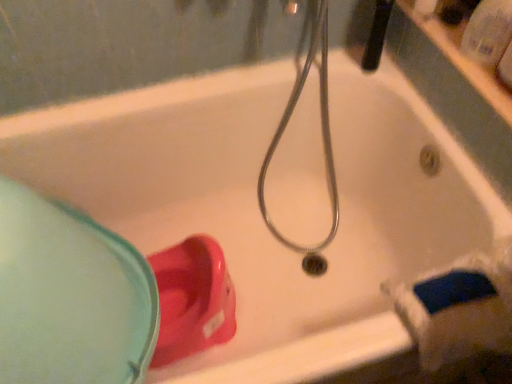
Describe the element at coordinates (376, 36) in the screenshot. I see `black rubber showerhead at upper center` at that location.

What is the approximate width of transparent plastic bottle at upper right?

It is 1.85 inches.

From the picture: Measure the distance between point (473,11) and camera.

The depth of point (473,11) is 83.50 centimeters.

You are a GUI agent. You are given a task and a screenshot of the screen. Output one action in this format:
    pyautogui.click(x=<x>, y=<y>)
    Task: Click on the matte plastic cup at lower left
    The width and height of the screenshot is (512, 384).
    Given the screenshot: What is the action you would take?
    pyautogui.click(x=97, y=297)

Who is bigger, black rubber showerhead at upper center or transparent plastic bottle at upper right?

Bigger between the two is black rubber showerhead at upper center.

Consider the image. Considering the sizes of black rubber showerhead at upper center and transparent plastic bottle at upper right in the image, is black rubber showerhead at upper center wider or thinner than transparent plastic bottle at upper right?

Considering their sizes, black rubber showerhead at upper center looks broader than transparent plastic bottle at upper right.

Is black rubber showerhead at upper center aimed at transparent plastic bottle at upper right?

No, black rubber showerhead at upper center is not oriented towards transparent plastic bottle at upper right.

Are black rubber showerhead at upper center and transparent plastic bottle at upper right making contact?

black rubber showerhead at upper center and transparent plastic bottle at upper right are not in contact.

Considering their positions, is matte plastic cup at lower left located in front of or behind black rubber showerhead at upper center?

Clearly, matte plastic cup at lower left is in front of black rubber showerhead at upper center.

Looking at this image, how many degrees apart are the facing directions of matte plastic cup at lower left and black rubber showerhead at upper center?

The facing directions of matte plastic cup at lower left and black rubber showerhead at upper center are 79.9 degrees apart.

Is matte plastic cup at lower left outside of black rubber showerhead at upper center?

That's correct, matte plastic cup at lower left is outside of black rubber showerhead at upper center.

Based on the photo, is matte plastic cup at lower left far away from black rubber showerhead at upper center?

That's not correct — matte plastic cup at lower left is a little close to black rubber showerhead at upper center.

Can you confirm if matte plastic cup at lower left is bigger than transparent plastic bottle at upper right?

Indeed, matte plastic cup at lower left has a larger size compared to transparent plastic bottle at upper right.

Between matte plastic cup at lower left and transparent plastic bottle at upper right, which one is positioned behind?

transparent plastic bottle at upper right.

Is matte plastic cup at lower left wider than transparent plastic bottle at upper right?

Yes, matte plastic cup at lower left is wider than transparent plastic bottle at upper right.

Is matte plastic cup at lower left facing towards transparent plastic bottle at upper right?

No.

Which point is more forward, (373, 50) or (106, 240)?

The point (106, 240) is in front.

Who is shorter, black rubber showerhead at upper center or matte plastic cup at lower left?

black rubber showerhead at upper center is shorter.

Is black rubber showerhead at upper center not near matte plastic cup at lower left?

No, black rubber showerhead at upper center is not far from matte plastic cup at lower left.

Identify the location of sink located in front of the transparent plastic bottle at upper right. (97, 297).

Between transparent plastic bottle at upper right and matte plastic cup at lower left, which one has larger width?

With larger width is matte plastic cup at lower left.

Based on their sizes in the image, would you say transparent plastic bottle at upper right is bigger or smaller than matte plastic cup at lower left?

Considering their sizes, transparent plastic bottle at upper right takes up less space than matte plastic cup at lower left.

Is transparent plastic bottle at upper right looking in the opposite direction of matte plastic cup at lower left?

No, transparent plastic bottle at upper right is not facing the opposite direction of matte plastic cup at lower left.

What's the angular difference between transparent plastic bottle at upper right and black rubber showerhead at upper center's facing directions?

The angular difference between transparent plastic bottle at upper right and black rubber showerhead at upper center is 21.6 degrees.

Looking at this image, from a real-world perspective, who is located lower, transparent plastic bottle at upper right or black rubber showerhead at upper center?

From a 3D spatial view, black rubber showerhead at upper center is below.

Is transparent plastic bottle at upper right spatially inside black rubber showerhead at upper center, or outside of it?

transparent plastic bottle at upper right lies outside black rubber showerhead at upper center.

Can you confirm if transparent plastic bottle at upper right is positioned to the left of black rubber showerhead at upper center?

Incorrect, transparent plastic bottle at upper right is not on the left side of black rubber showerhead at upper center.

Identify the location of toiletry on the right of black rubber showerhead at upper center. (490, 35).

Where is `sink lying on the left of black rubber showerhead at upper center`? Image resolution: width=512 pixels, height=384 pixels. sink lying on the left of black rubber showerhead at upper center is located at coordinates (97, 297).

When comparing their distances from matte plastic cup at lower left, does transparent plastic bottle at upper right or black rubber showerhead at upper center seem closer?

black rubber showerhead at upper center is positioned closer to the anchor matte plastic cup at lower left.

Based on their spatial positions, is matte plastic cup at lower left or black rubber showerhead at upper center closer to transparent plastic bottle at upper right?

black rubber showerhead at upper center is closer to transparent plastic bottle at upper right.

Looking at this image, from the image, which object appears to be nearer to transparent plastic bottle at upper right, black rubber showerhead at upper center or matte plastic cup at lower left?

Among the two, black rubber showerhead at upper center is located nearer to transparent plastic bottle at upper right.

Considering their positions, is transparent plastic bottle at upper right positioned closer to black rubber showerhead at upper center than matte plastic cup at lower left?

transparent plastic bottle at upper right is closer to black rubber showerhead at upper center.

Estimate the real-world distances between objects in this image. Which object is further from black rubber showerhead at upper center, matte plastic cup at lower left or transparent plastic bottle at upper right?

matte plastic cup at lower left lies further to black rubber showerhead at upper center than the other object.

Considering their positions, is black rubber showerhead at upper center positioned further to matte plastic cup at lower left than transparent plastic bottle at upper right?

Based on the image, transparent plastic bottle at upper right appears to be further to matte plastic cup at lower left.

Find the location of `shower located between matte plastic cup at lower left and transparent plastic bottle at upper right in the left-right direction`. shower located between matte plastic cup at lower left and transparent plastic bottle at upper right in the left-right direction is located at coordinates (376, 36).